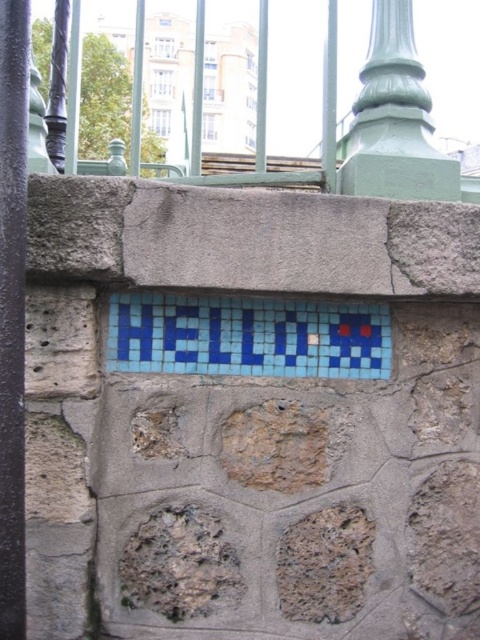
Can you confirm if blue mosaic tiles at center is bigger than smooth purple pole at left?

Correct, blue mosaic tiles at center is larger in size than smooth purple pole at left.

Does blue mosaic tiles at center appear under smooth purple pole at left?

Yes.

Find the location of `blue mosaic tiles at center`. blue mosaic tiles at center is located at coordinates 248,337.

Is green painted metal fence at upper center thinner than green painted metal pillar at upper center?

Incorrect, green painted metal fence at upper center's width is not less than green painted metal pillar at upper center's.

Who is positioned more to the left, green painted metal fence at upper center or green painted metal pillar at upper center?

From the viewer's perspective, green painted metal fence at upper center appears more on the left side.

Is point (421, 74) closer to camera compared to point (375, 132)?

No.

Where is `green painted metal fence at upper center`? This screenshot has width=480, height=640. green painted metal fence at upper center is located at coordinates (354, 120).

Does blue mosaic tiles at center have a smaller size compared to green painted metal pillar at upper center?

Yes.

Between point (230, 326) and point (442, 184), which one is positioned behind?

The point (442, 184) is more distant.

In order to click on blue mosaic tiles at center in this screenshot , I will do `click(248, 337)`.